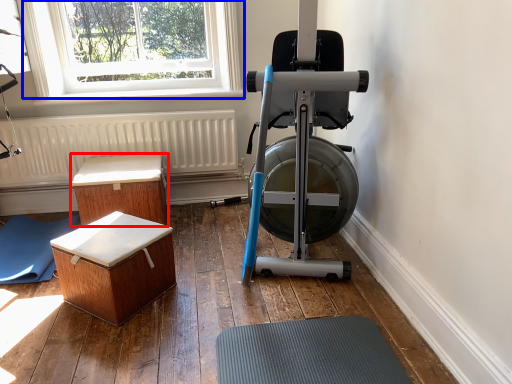
Question: Which point is closer to the camera, furniture (highlighted by a red box) or window (highlighted by a blue box)?

Choices:
 (A) furniture
 (B) window

Answer: (A)